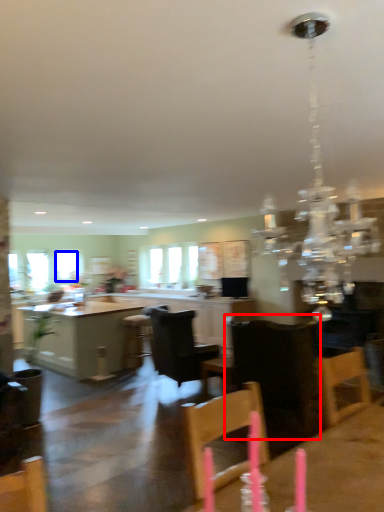
Question: Which point is further to the camera, chair (highlighted by a red box) or window (highlighted by a blue box)?

Choices:
 (A) chair
 (B) window

Answer: (B)